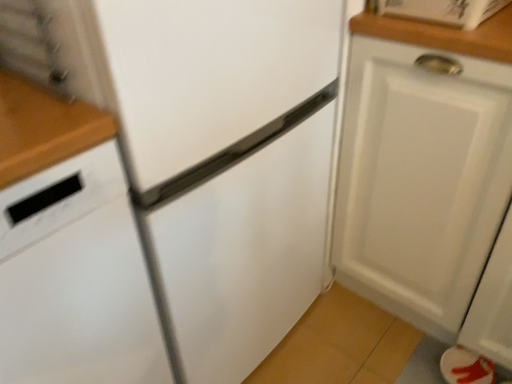
Describe the element at coordinates (76, 279) in the screenshot. I see `white matte dishwasher at left` at that location.

Locate an element on the screen. This screenshot has height=384, width=512. white matte dishwasher at left is located at coordinates (76, 279).

The height and width of the screenshot is (384, 512). Find the location of `white matte cabinet at right`. white matte cabinet at right is located at coordinates (421, 180).

The width and height of the screenshot is (512, 384). What do you see at coordinates (421, 180) in the screenshot?
I see `white matte cabinet at right` at bounding box center [421, 180].

Measure the distance between point (x=460, y=213) and camera.

A distance of 37.48 inches exists between point (x=460, y=213) and camera.

Where is `white matte dishwasher at left`? white matte dishwasher at left is located at coordinates (76, 279).

Considering the relative positions of white matte cabinet at right and white matte dishwasher at left in the image provided, is white matte cabinet at right to the right of white matte dishwasher at left from the viewer's perspective?

Indeed, white matte cabinet at right is positioned on the right side of white matte dishwasher at left.

Based on the photo, is the position of white matte cabinet at right less distant than that of white matte dishwasher at left?

That is False.

Which point is more distant from viewer, (366, 96) or (111, 355)?

Positioned behind is point (366, 96).

From the image's perspective, which one is positioned higher, white matte cabinet at right or white matte dishwasher at left?

white matte cabinet at right appears higher in the image.

Based on the photo, from a real-world perspective, relative to white matte dishwasher at left, is white matte cabinet at right vertically above or below?

Clearly, from a real-world perspective, white matte cabinet at right is above white matte dishwasher at left.

Is white matte cabinet at right wider than white matte dishwasher at left?

No.

In terms of height, does white matte cabinet at right look taller or shorter compared to white matte dishwasher at left?

Considering their sizes, white matte cabinet at right has less height than white matte dishwasher at left.

Looking at the image, does white matte cabinet at right seem bigger or smaller compared to white matte dishwasher at left?

Considering their sizes, white matte cabinet at right takes up more space than white matte dishwasher at left.

Would you say white matte cabinet at right is inside or outside white matte dishwasher at left?

white matte cabinet at right is not enclosed by white matte dishwasher at left.

Is white matte cabinet at right directly adjacent to white matte dishwasher at left?

No, white matte cabinet at right is not in contact with white matte dishwasher at left.

Is white matte cabinet at right aimed at white matte dishwasher at left?

No, white matte cabinet at right does not turn towards white matte dishwasher at left.

How different are the orientations of white matte cabinet at right and white matte dishwasher at left in degrees?

The facing directions of white matte cabinet at right and white matte dishwasher at left are 89 degrees apart.

The width and height of the screenshot is (512, 384). What are the coordinates of `dish washer below the white matte cabinet at right (from a real-world perspective)` in the screenshot? It's located at (76, 279).

Can you confirm if white matte dishwasher at left is positioned to the right of white matte cabinet at right?

In fact, white matte dishwasher at left is to the left of white matte cabinet at right.

Is white matte dishwasher at left closer to camera compared to white matte cabinet at right?

That is True.

Considering the positions of points (35, 372) and (428, 223), is point (35, 372) farther from camera compared to point (428, 223)?

No, it is in front of (428, 223).

From the image's perspective, which one is positioned lower, white matte dishwasher at left or white matte cabinet at right?

white matte dishwasher at left is shown below in the image.

Consider the image. From a real-world perspective, who is located higher, white matte dishwasher at left or white matte cabinet at right?

white matte cabinet at right, from a real-world perspective.

Considering the sizes of white matte dishwasher at left and white matte cabinet at right in the image, is white matte dishwasher at left wider or thinner than white matte cabinet at right?

Considering their sizes, white matte dishwasher at left looks broader than white matte cabinet at right.

Consider the image. Can you confirm if white matte dishwasher at left is taller than white matte cabinet at right?

Yes, white matte dishwasher at left is taller than white matte cabinet at right.

Considering the sizes of objects white matte dishwasher at left and white matte cabinet at right in the image provided, who is smaller, white matte dishwasher at left or white matte cabinet at right?

white matte dishwasher at left.

Is white matte cabinet at right inside white matte dishwasher at left?

Definitely not — white matte cabinet at right is not inside white matte dishwasher at left.

Are white matte dishwasher at left and white matte cabinet at right far apart?

white matte dishwasher at left is near white matte cabinet at right, not far away.

Is white matte dishwasher at left facing away from white matte cabinet at right?

No, white matte dishwasher at left's orientation is not away from white matte cabinet at right.

Locate an element on the screen. The height and width of the screenshot is (384, 512). dish washer in front of the white matte cabinet at right is located at coordinates (76, 279).

Find the location of a particular element. cabinetry above the white matte dishwasher at left (from the image's perspective) is located at coordinates (421, 180).

Where is `dish washer located in front of the white matte cabinet at right`? dish washer located in front of the white matte cabinet at right is located at coordinates [x=76, y=279].